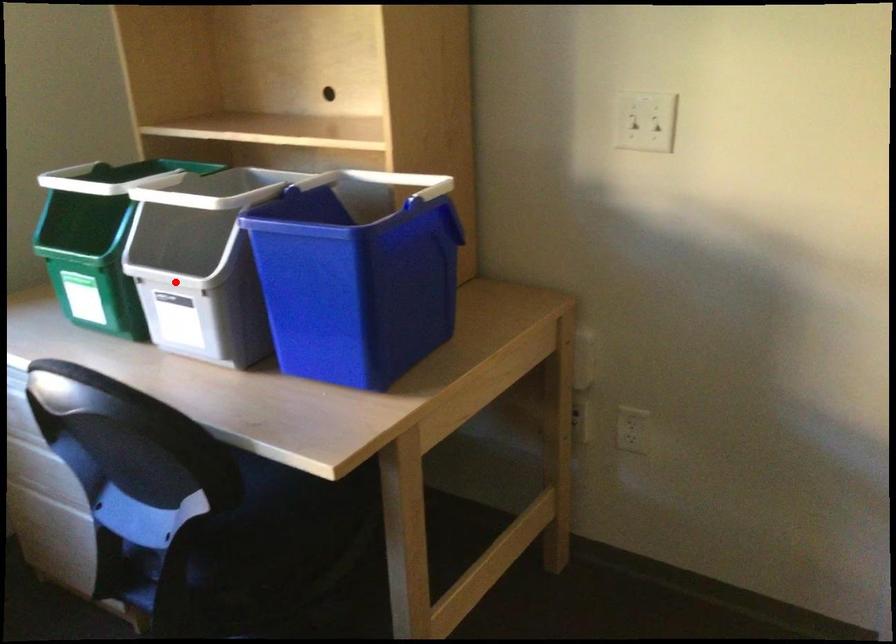
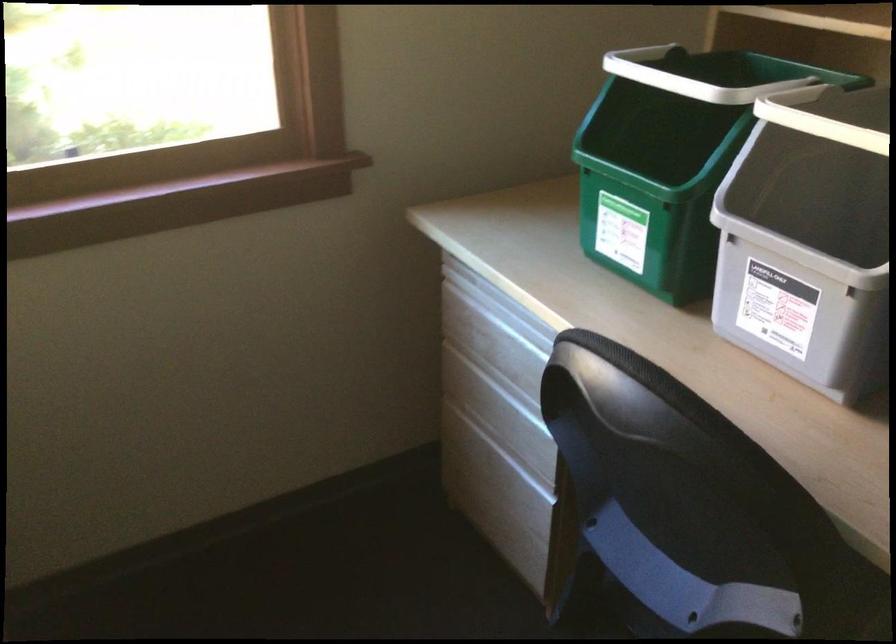
Question: I am providing you with two images of the same scene from different viewpoints. In image1, a red point is highlighted. Considering the same 3D point in image2, which of the following is correct?

Choices:
 (A) It is closer
 (B) It is farther

Answer: (A)